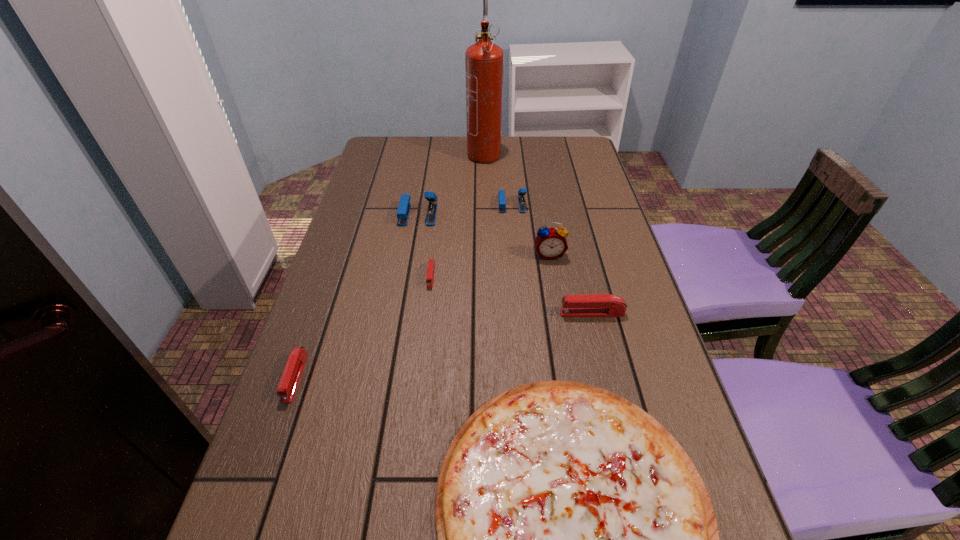
Locate an element on the screen. The height and width of the screenshot is (540, 960). free location located 0.200m on the front-facing side of the biggest red stapler is located at coordinates (476, 313).

Where is `vacant area located on the front-facing side of the nearest stapler`? Image resolution: width=960 pixels, height=540 pixels. vacant area located on the front-facing side of the nearest stapler is located at coordinates (249, 511).

At what (x,y) coordinates should I click in order to perform the action: click on vacant space located on the front-facing side of the seventh tallest object. Please return your answer as a coordinate pair (x, y). The image size is (960, 540). Looking at the image, I should click on (424, 336).

Where is `object positioned at the far edge`? object positioned at the far edge is located at coordinates (484, 61).

In order to click on object positioned at the right edge in this screenshot , I will do `click(592, 305)`.

This screenshot has width=960, height=540. Find the location of `free space at the far edge of the desktop`. free space at the far edge of the desktop is located at coordinates (444, 156).

What are the coordinates of `vacant area at the left edge of the desktop` in the screenshot? It's located at (334, 508).

This screenshot has height=540, width=960. Identify the location of vacant space at the right edge of the desktop. (613, 293).

Image resolution: width=960 pixels, height=540 pixels. In the image, there is a desktop. What are the coordinates of `free space at the far right corner` in the screenshot? It's located at (592, 169).

This screenshot has height=540, width=960. What are the coordinates of `empty space that is in between the fourth farthest object and the second tallest stapler` in the screenshot? It's located at (531, 230).